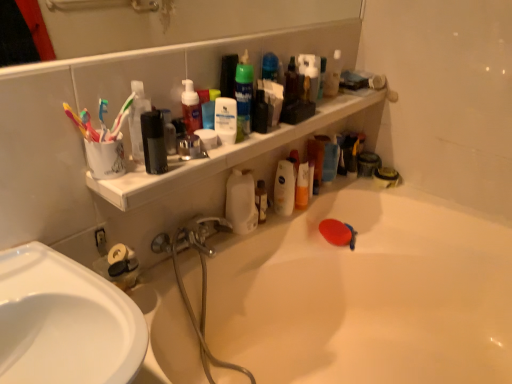
Question: Is green matte shaving cream can at upper center, placed as the 2th cleaning product when sorted from right to left, positioned before translucent plastic spray bottle at upper center, positioned as the 1th cleaning product in back-to-front order?

Choices:
 (A) no
 (B) yes

Answer: (B)

Question: Considering the relative positions of green matte shaving cream can at upper center, which ranks as the 4th cleaning product in left-to-right order, and translucent plastic spray bottle at upper center, which appears as the 1th cleaning product when viewed from the right, in the image provided, is green matte shaving cream can at upper center, which ranks as the 4th cleaning product in left-to-right order, to the left of translucent plastic spray bottle at upper center, which appears as the 1th cleaning product when viewed from the right, from the viewer's perspective?

Choices:
 (A) no
 (B) yes

Answer: (B)

Question: From the image's perspective, is green matte shaving cream can at upper center, which ranks as the 3th cleaning product in back-to-front order, located beneath translucent plastic spray bottle at upper center, the 5th cleaning product when ordered from front to back?

Choices:
 (A) yes
 (B) no

Answer: (A)

Question: Is green matte shaving cream can at upper center, which ranks as the 4th cleaning product in left-to-right order, thinner than translucent plastic spray bottle at upper center, the 5th cleaning product when ordered from front to back?

Choices:
 (A) no
 (B) yes

Answer: (A)

Question: Is green matte shaving cream can at upper center, which ranks as the 3th cleaning product in back-to-front order, oriented away from translucent plastic spray bottle at upper center, which appears as the 1th cleaning product when viewed from the right?

Choices:
 (A) no
 (B) yes

Answer: (A)

Question: Can you confirm if green matte shaving cream can at upper center, which ranks as the third cleaning product in front-to-back order, is shorter than translucent plastic spray bottle at upper center, the 5th cleaning product when ordered from front to back?

Choices:
 (A) no
 (B) yes

Answer: (A)

Question: Considering the relative sizes of translucent plastic spray bottle at upper center, which appears as the 1th cleaning product when viewed from the right, and matte red soap dispenser at upper center, which is the fifth cleaning product from right to left, in the image provided, is translucent plastic spray bottle at upper center, which appears as the 1th cleaning product when viewed from the right, bigger than matte red soap dispenser at upper center, which is the fifth cleaning product from right to left,?

Choices:
 (A) no
 (B) yes

Answer: (A)

Question: Could you tell me if translucent plastic spray bottle at upper center, positioned as the 1th cleaning product in back-to-front order, is turned towards matte red soap dispenser at upper center, which is the fifth cleaning product from right to left?

Choices:
 (A) no
 (B) yes

Answer: (A)

Question: From a real-world perspective, is translucent plastic spray bottle at upper center, the 5th cleaning product when ordered from front to back, positioned under matte red soap dispenser at upper center, which is the fifth cleaning product in back-to-front order, based on gravity?

Choices:
 (A) no
 (B) yes

Answer: (B)

Question: Considering the relative sizes of translucent plastic spray bottle at upper center, which appears as the 1th cleaning product when viewed from the right, and matte red soap dispenser at upper center, which is the fifth cleaning product from right to left, in the image provided, is translucent plastic spray bottle at upper center, which appears as the 1th cleaning product when viewed from the right, smaller than matte red soap dispenser at upper center, which is the fifth cleaning product from right to left,?

Choices:
 (A) yes
 (B) no

Answer: (A)

Question: Is translucent plastic spray bottle at upper center, placed as the 5th cleaning product when sorted from left to right, far from matte red soap dispenser at upper center, the 1th cleaning product positioned from the left?

Choices:
 (A) yes
 (B) no

Answer: (B)

Question: Is translucent plastic spray bottle at upper center, the 5th cleaning product when ordered from front to back, completely or partially outside of matte red soap dispenser at upper center, which is the first cleaning product in front-to-back order?

Choices:
 (A) yes
 (B) no

Answer: (A)

Question: Is matte red soap dispenser at upper center, which is the first cleaning product in front-to-back order, oriented away from translucent plastic toothbrush at upper left, the first toothbrush in the right-to-left sequence?

Choices:
 (A) no
 (B) yes

Answer: (A)